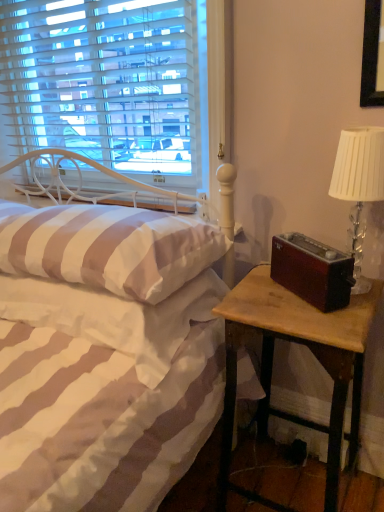
Question: Is wooden nightstand at right not within clear glass table lamp at right?

Choices:
 (A) yes
 (B) no

Answer: (A)

Question: From the image's perspective, is wooden nightstand at right above clear glass table lamp at right?

Choices:
 (A) no
 (B) yes

Answer: (A)

Question: Considering the relative sizes of wooden nightstand at right and clear glass table lamp at right in the image provided, is wooden nightstand at right smaller than clear glass table lamp at right?

Choices:
 (A) no
 (B) yes

Answer: (A)

Question: From a real-world perspective, is wooden nightstand at right beneath clear glass table lamp at right?

Choices:
 (A) no
 (B) yes

Answer: (B)

Question: From a real-world perspective, is wooden nightstand at right on top of clear glass table lamp at right?

Choices:
 (A) no
 (B) yes

Answer: (A)

Question: Considering the relative sizes of wooden nightstand at right and clear glass table lamp at right in the image provided, is wooden nightstand at right shorter than clear glass table lamp at right?

Choices:
 (A) no
 (B) yes

Answer: (A)

Question: From a real-world perspective, is clear glass table lamp at right located higher than wooden nightstand at right?

Choices:
 (A) yes
 (B) no

Answer: (A)

Question: Is clear glass table lamp at right not within wooden nightstand at right?

Choices:
 (A) yes
 (B) no

Answer: (A)

Question: Considering the relative positions of clear glass table lamp at right and wooden nightstand at right in the image provided, is clear glass table lamp at right behind wooden nightstand at right?

Choices:
 (A) yes
 (B) no

Answer: (A)

Question: Could you tell me if clear glass table lamp at right is turned towards wooden nightstand at right?

Choices:
 (A) no
 (B) yes

Answer: (A)

Question: Is clear glass table lamp at right to the right of wooden nightstand at right from the viewer's perspective?

Choices:
 (A) yes
 (B) no

Answer: (A)

Question: Are clear glass table lamp at right and wooden nightstand at right far apart?

Choices:
 (A) no
 (B) yes

Answer: (A)

Question: Considering the relative sizes of wooden nightstand at right and white striped fabric at lower left in the image provided, is wooden nightstand at right taller than white striped fabric at lower left?

Choices:
 (A) no
 (B) yes

Answer: (B)